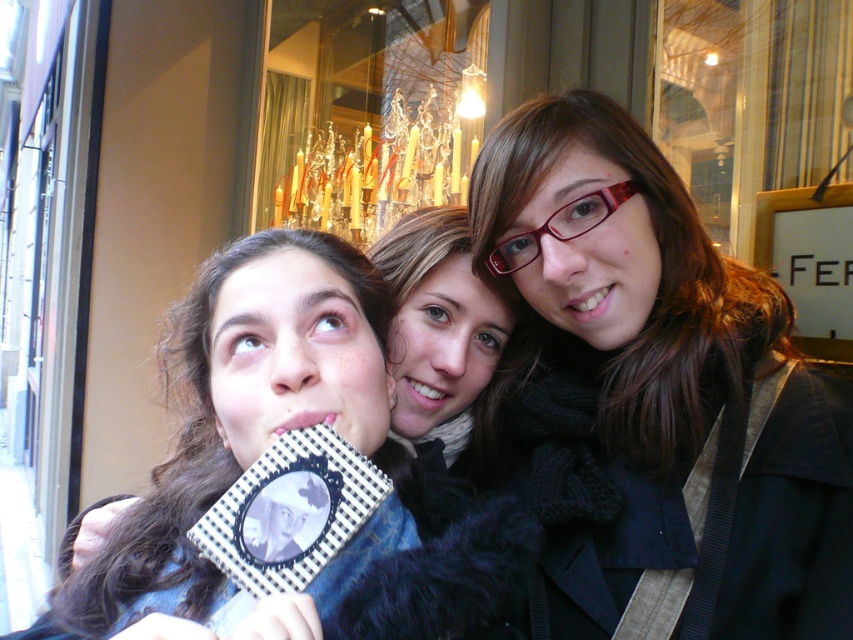
You are a photographer trying to capture a clear shot of the crystal chandelier at upper center. However, the matte black scarf at center is blocking your view. Can you adjust your position to avoid the scarf while still keeping the chandelier in the frame?

The matte black scarf at center is in front of the crystal chandelier at upper center, so moving your camera position slightly to the side or angle it upward might allow you to capture the chandelier without the scarf blocking it while keeping the chandelier in the frame.

You are standing in front of the scene and want to pick up the closest object between the matte black book at center and the crystal chandelier at upper center. Which one should you choose?

The matte black book at center is closer to the viewer than the crystal chandelier at upper center, so you should pick up the matte black book at center.

Based on the scene description, which object is shorter between the matte black scarf at center and the crystal chandelier at upper center?

The matte black scarf at center is shorter than the crystal chandelier at upper center.